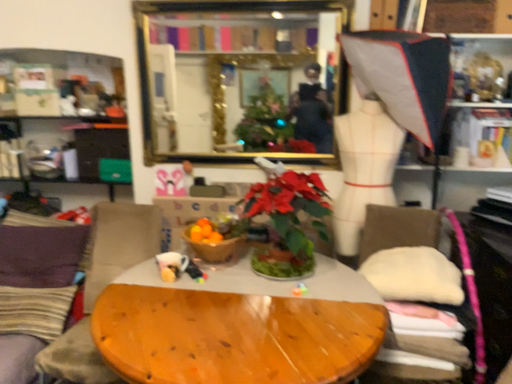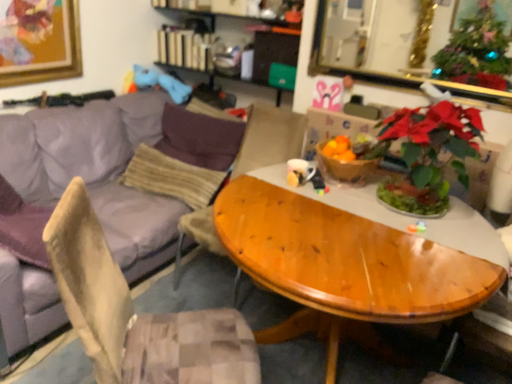
Question: Which way did the camera rotate in the video?

Choices:
 (A) rotated downward
 (B) rotated upward

Answer: (A)